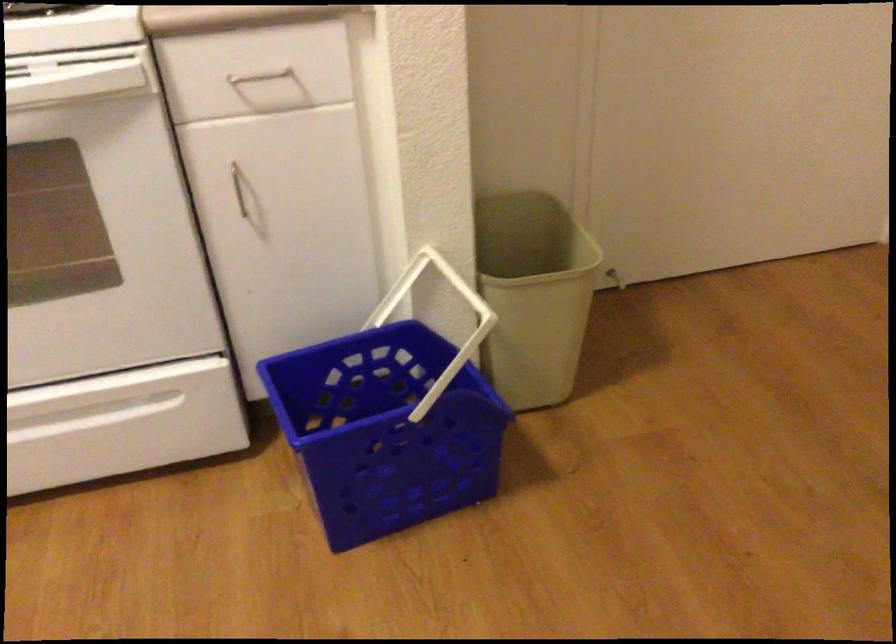
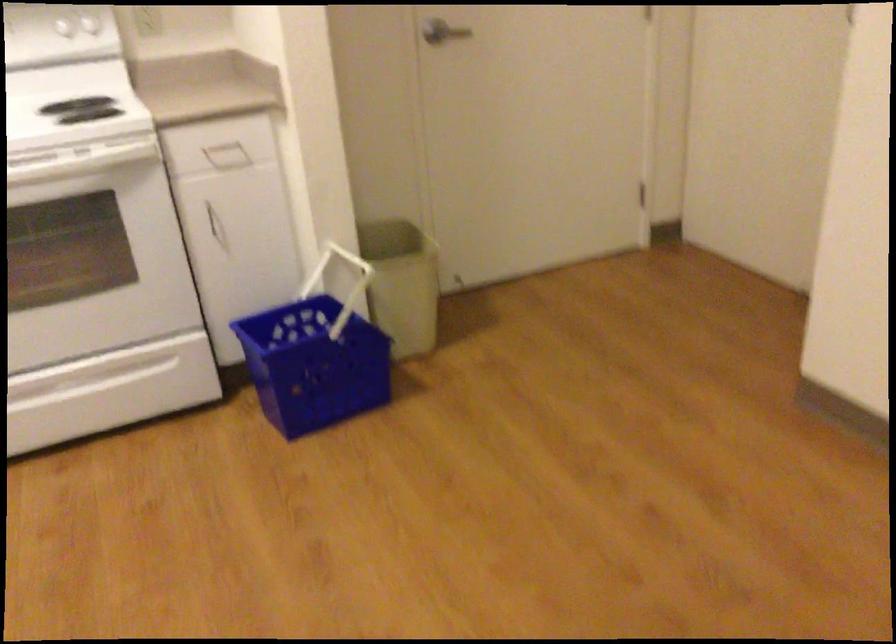
In the second image, find the point that corresponds to (530,316) in the first image.

(401, 283)